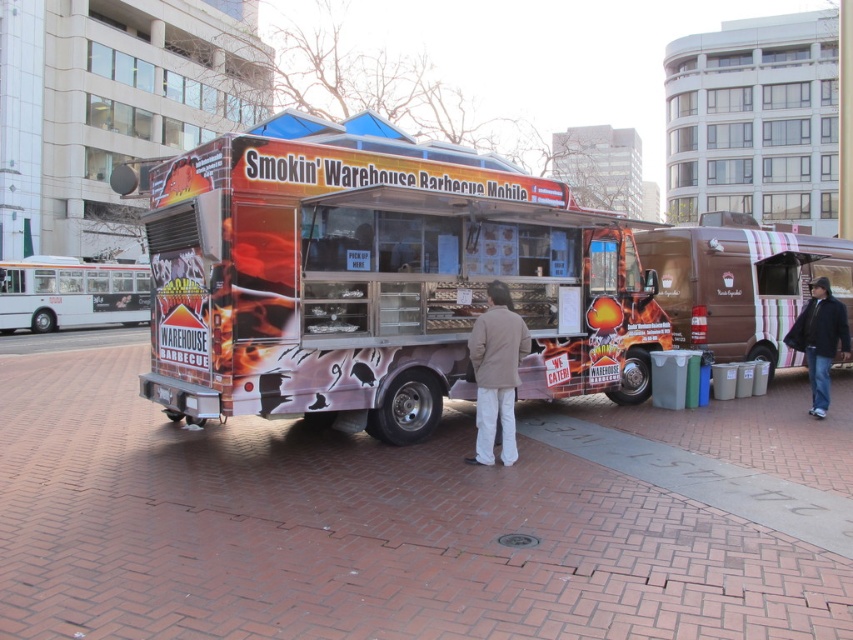
You are a customer waiting in line at the food truck and want to know if you can place your phone on the brick pavement at center while ordering. Considering the dark blue jeans at lower right are already occupying space, will there be enough room? Please explain based on their widths.

The brick pavement at center is wider than the dark blue jeans at lower right. Since the jeans are on the lower right, there should be sufficient space remaining on the brick pavement at center to place your phone.

You are a customer waiting in line at the Smokin Warehouse Barbecue Mobile food truck. You notice two items in the scene. One is a light beige jacket at center and the other is dark blue jeans at lower right. Which item is shorter in height?

The light beige jacket at center has a lesser height compared to dark blue jeans at lower right, so the light beige jacket at center is shorter in height.

You are standing in front of the Smokin Warehouse Barbecue Mobile food truck. You notice two points on the truck. One is at point (488,314) and the other is at point (840,330). Which point is closer to you?

Point (488,314) is closer to the camera than point (840,330).